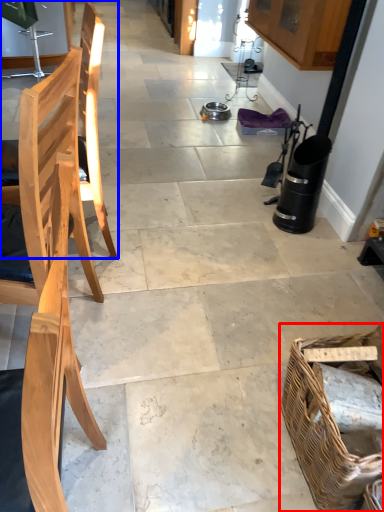
Question: Which point is closer to the camera, picnic basket (highlighted by a red box) or chair (highlighted by a blue box)?

Choices:
 (A) picnic basket
 (B) chair

Answer: (A)